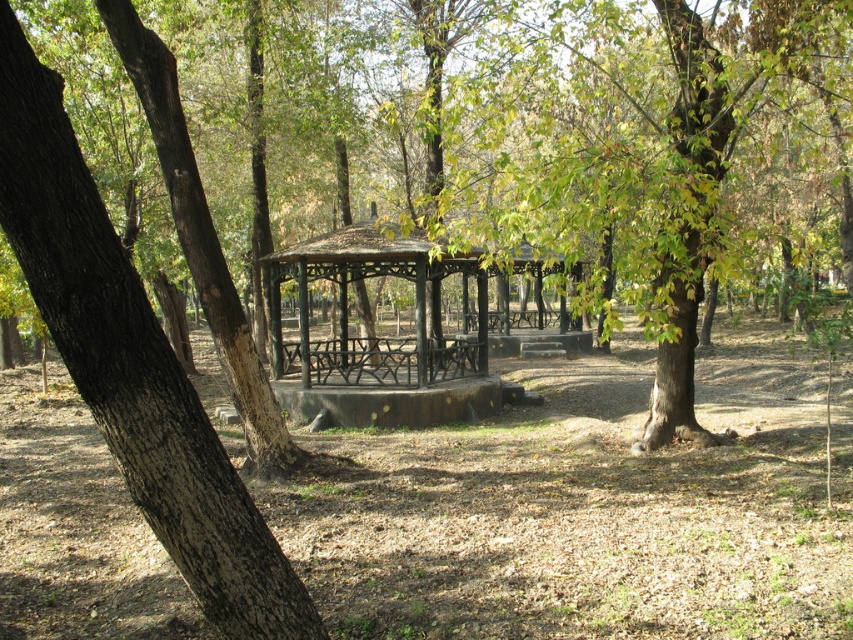
Is the position of brown wood tree at center more distant than that of rustic wood gazebo at center?

No.

Is brown wood tree at center bigger than rustic wood gazebo at center?

Indeed, brown wood tree at center has a larger size compared to rustic wood gazebo at center.

Image resolution: width=853 pixels, height=640 pixels. I want to click on brown wood tree at center, so click(657, 154).

Does brown rough bark tree at left have a larger size compared to rustic wood gazebo at center?

No.

Is point (164, 486) closer to camera compared to point (454, 376)?

Yes, it is in front of point (454, 376).

Is point (257, 598) closer to camera compared to point (334, 376)?

Yes, point (257, 598) is closer to viewer.

Locate an element on the screen. brown rough bark tree at left is located at coordinates (131, 364).

Can you confirm if brown wood tree at center is taller than brown rough bark tree at left?

Yes.

Between brown wood tree at center and brown rough bark tree at left, which one is positioned lower?

brown rough bark tree at left

Find the location of `brown wood tree at center`. brown wood tree at center is located at coordinates (657, 154).